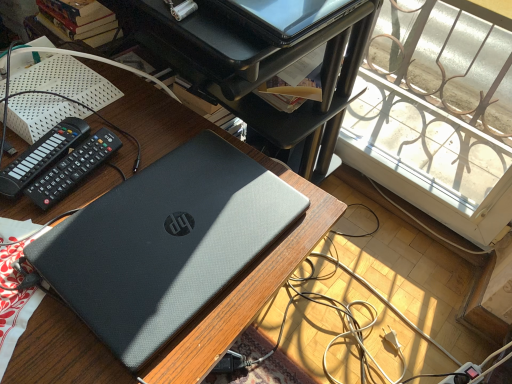
I want to click on vacant area on the back side of black plastic remote at left, which ranks as the 2th control in right-to-left order, so click(x=106, y=110).